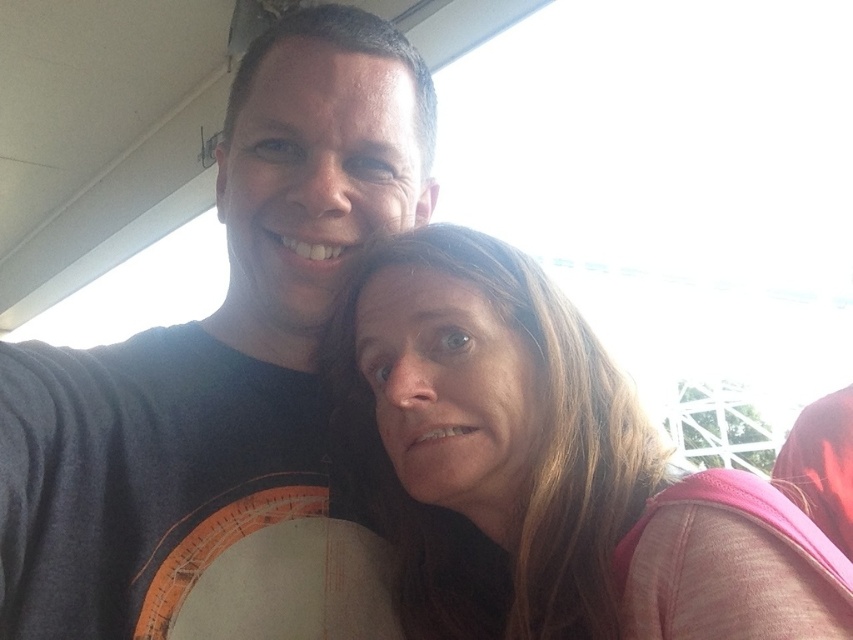
You are standing at the point labeled as point (x=109, y=528) and want to take a selfie with the two people in the scene. Considering your height is 68 inches, can you comfortably hold your phone to capture both individuals in the frame without bending down?

The point labeled as point (x=109, y=528) is 30.66 inches away from the viewer. Since the viewer is 68 inches tall, they can comfortably hold their phone at this distance to capture both individuals in the frame without needing to bend down.